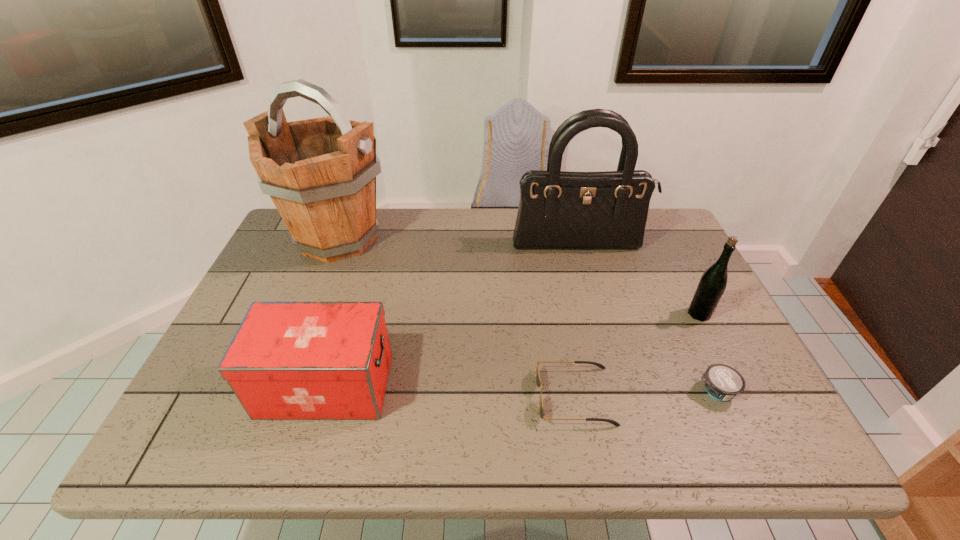
This screenshot has height=540, width=960. What are the coordinates of `vacant space at the right edge of the desktop` in the screenshot? It's located at (680, 257).

Where is `vacant space at the near left corner of the desktop`? The image size is (960, 540). vacant space at the near left corner of the desktop is located at coordinates (207, 421).

The image size is (960, 540). In the image, there is a desktop. In order to click on free space at the near right corner in this screenshot , I will do `click(735, 420)`.

At what (x,y) coordinates should I click in order to perform the action: click on vacant point located between the yogurt and the bucket. Please return your answer as a coordinate pair (x, y). The width and height of the screenshot is (960, 540). Looking at the image, I should click on (527, 315).

I want to click on blank region between the fourth shortest object and the sunglasses, so click(636, 355).

Locate an element on the screen. The width and height of the screenshot is (960, 540). free space between the yogurt and the bucket is located at coordinates (527, 315).

This screenshot has width=960, height=540. What are the coordinates of `free space between the first-aid kit and the yogurt` in the screenshot? It's located at (520, 388).

You are a GUI agent. You are given a task and a screenshot of the screen. Output one action in this format:
    pyautogui.click(x=<x>, y=<y>)
    Task: Click on the vacant area that lies between the bucket and the handbag
    
    Given the screenshot: What is the action you would take?
    point(459,242)

This screenshot has width=960, height=540. Identify the location of vacant area that lies between the first-aid kit and the yogurt. (520, 388).

This screenshot has width=960, height=540. I want to click on unoccupied area between the sunglasses and the fourth shortest object, so [636, 355].